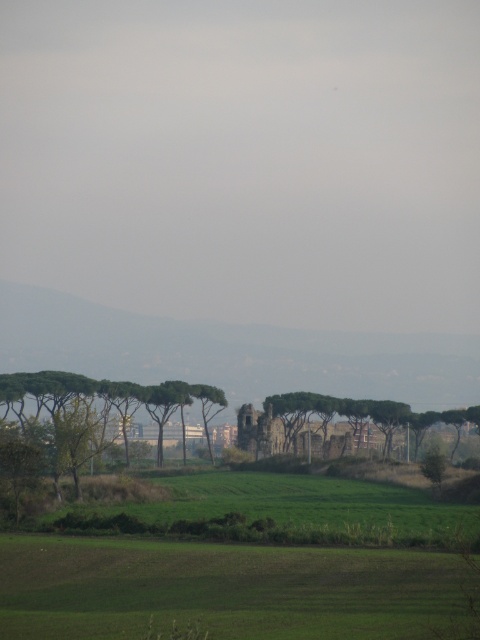
You are standing at the point with coordinates point (317, 394) and want to walk towards the point with coordinates point (104, 428). Which direction should you move relative to your current position?

You should move forward because point (104, 428) is in front of point (317, 394).